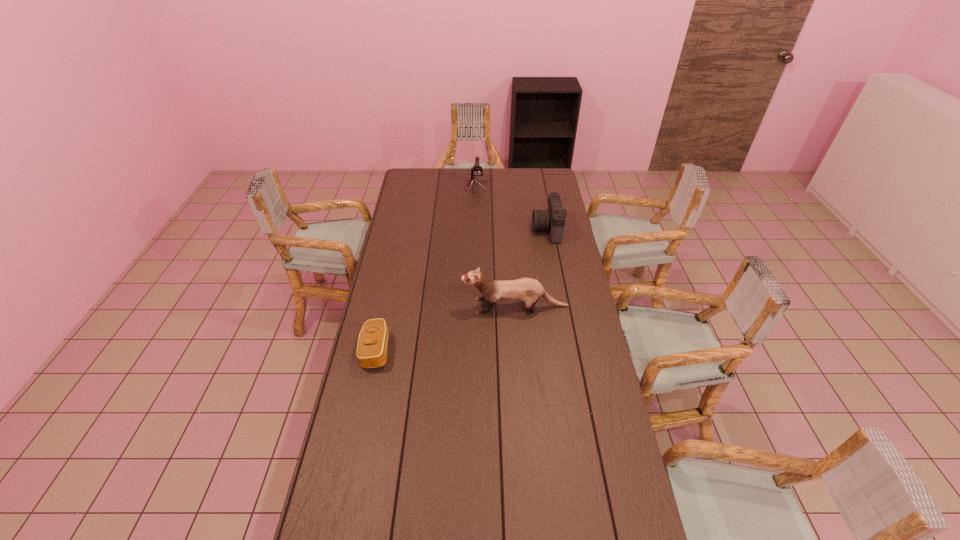
You are a GUI agent. You are given a task and a screenshot of the screen. Output one action in this format:
    pyautogui.click(x=<x>, y=<y>)
    Task: Click on the free location at the far left corner
    This screenshot has width=960, height=540.
    Given the screenshot: What is the action you would take?
    pyautogui.click(x=401, y=184)

The width and height of the screenshot is (960, 540). I want to click on free space between the nearest object and the camera, so click(462, 290).

The width and height of the screenshot is (960, 540). I want to click on free space that is in between the third nearest object and the earphone, so click(511, 208).

The image size is (960, 540). I want to click on empty location between the nearest object and the third nearest object, so click(462, 290).

Identify the location of empty location between the earphone and the leftmost object. pyautogui.click(x=425, y=269).

Where is `vacant area between the earphone and the third farthest object`? Image resolution: width=960 pixels, height=540 pixels. vacant area between the earphone and the third farthest object is located at coordinates (495, 247).

This screenshot has width=960, height=540. Identify the location of free space that is in between the ferret and the earphone. (495, 247).

Identify the location of vacant region between the earphone and the ferret. (495, 247).

This screenshot has width=960, height=540. What are the coordinates of `free space between the ferret and the leftmost object` in the screenshot? It's located at (445, 328).

At what (x,y) coordinates should I click in order to perform the action: click on free space that is in between the earphone and the third nearest object. Please return your answer as a coordinate pair (x, y). This screenshot has width=960, height=540. Looking at the image, I should click on (511, 208).